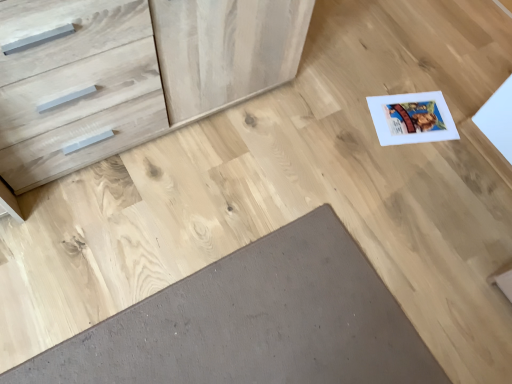
Locate an element on the screen. The image size is (512, 384). natural wood chest of drawers at upper left is located at coordinates (130, 73).

Describe the element at coordinates (130, 73) in the screenshot. I see `natural wood chest of drawers at upper left` at that location.

The width and height of the screenshot is (512, 384). What are the coordinates of `brown matte doormat at lower center` in the screenshot? It's located at (255, 322).

This screenshot has height=384, width=512. What do you see at coordinates (255, 322) in the screenshot?
I see `brown matte doormat at lower center` at bounding box center [255, 322].

Identify the location of natural wood chest of drawers at upper left. (130, 73).

Is brown matte doormat at lower center at the left side of natural wood chest of drawers at upper left?

No.

Is brown matte doormat at lower center in front of or behind natural wood chest of drawers at upper left in the image?

brown matte doormat at lower center is behind natural wood chest of drawers at upper left.

Is point (333, 310) behind point (98, 112)?

Yes, it is behind point (98, 112).

From the image's perspective, which is above, brown matte doormat at lower center or natural wood chest of drawers at upper left?

natural wood chest of drawers at upper left.

From a real-world perspective, is brown matte doormat at lower center physically located above or below natural wood chest of drawers at upper left?

From a real-world perspective, brown matte doormat at lower center is physically below natural wood chest of drawers at upper left.

Does brown matte doormat at lower center have a greater width compared to natural wood chest of drawers at upper left?

Yes, brown matte doormat at lower center is wider than natural wood chest of drawers at upper left.

Considering the sizes of objects brown matte doormat at lower center and natural wood chest of drawers at upper left in the image provided, who is taller, brown matte doormat at lower center or natural wood chest of drawers at upper left?

natural wood chest of drawers at upper left is taller.

Which of these two, brown matte doormat at lower center or natural wood chest of drawers at upper left, is smaller?

Smaller between the two is brown matte doormat at lower center.

Is brown matte doormat at lower center outside of natural wood chest of drawers at upper left?

brown matte doormat at lower center is positioned outside natural wood chest of drawers at upper left.

Are brown matte doormat at lower center and natural wood chest of drawers at upper left making contact?

They are not placed beside each other.

Is brown matte doormat at lower center facing towards natural wood chest of drawers at upper left?

No, brown matte doormat at lower center is not oriented towards natural wood chest of drawers at upper left.

Where is `doormat below the natural wood chest of drawers at upper left (from a real-world perspective)`? This screenshot has height=384, width=512. doormat below the natural wood chest of drawers at upper left (from a real-world perspective) is located at coordinates (255, 322).

Visually, is natural wood chest of drawers at upper left positioned to the left or to the right of brown matte doormat at lower center?

natural wood chest of drawers at upper left is positioned on brown matte doormat at lower center's left side.

Does natural wood chest of drawers at upper left come in front of brown matte doormat at lower center?

Yes, natural wood chest of drawers at upper left is closer to the camera.

Is point (89, 162) more distant than point (325, 377)?

That is True.

From the image's perspective, would you say natural wood chest of drawers at upper left is shown under brown matte doormat at lower center?

No, from the image's perspective, natural wood chest of drawers at upper left is not beneath brown matte doormat at lower center.

From a real-world perspective, is natural wood chest of drawers at upper left below brown matte doormat at lower center?

No.

Looking at this image, considering the sizes of objects natural wood chest of drawers at upper left and brown matte doormat at lower center in the image provided, who is thinner, natural wood chest of drawers at upper left or brown matte doormat at lower center?

natural wood chest of drawers at upper left is thinner.

In terms of height, does natural wood chest of drawers at upper left look taller or shorter compared to brown matte doormat at lower center?

natural wood chest of drawers at upper left is taller than brown matte doormat at lower center.

In the scene shown: Between natural wood chest of drawers at upper left and brown matte doormat at lower center, which one has larger size?

Bigger between the two is natural wood chest of drawers at upper left.

Choose the correct answer: Is natural wood chest of drawers at upper left inside brown matte doormat at lower center or outside it?

The correct answer is: outside.

Would you say natural wood chest of drawers at upper left is a long distance from brown matte doormat at lower center?

Actually, natural wood chest of drawers at upper left and brown matte doormat at lower center are a little close together.

Looking at this image, is natural wood chest of drawers at upper left oriented towards brown matte doormat at lower center?

Yes, natural wood chest of drawers at upper left is turned towards brown matte doormat at lower center.

You are a GUI agent. You are given a task and a screenshot of the screen. Output one action in this format:
    pyautogui.click(x=<x>, y=<y>)
    Task: Click on the doormat on the right of natural wood chest of drawers at upper left
    The width and height of the screenshot is (512, 384).
    Given the screenshot: What is the action you would take?
    pyautogui.click(x=255, y=322)

Identify the location of chest of drawers in front of the brown matte doormat at lower center. (130, 73).

There is a brown matte doormat at lower center. Identify the location of the chest of drawers above it (from a real-world perspective). The image size is (512, 384). (130, 73).